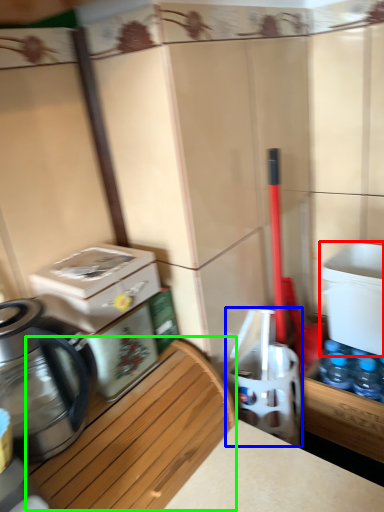
Question: Considering the real-world distances, which object is closest to water cooler (highlighted by a red box)? water cooler (highlighted by a blue box) or wood (highlighted by a green box).

Choices:
 (A) water cooler
 (B) wood

Answer: (A)